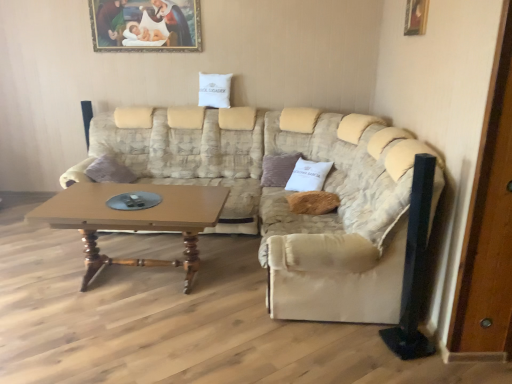
Question: Considering the relative positions of wooden picture frame at upper right, which is the 1th picture frame in bottom-to-top order, and wooden framed painting at upper center, marked as the 2th picture frame in a front-to-back arrangement, in the image provided, is wooden picture frame at upper right, which is the 1th picture frame in bottom-to-top order, to the right of wooden framed painting at upper center, marked as the 2th picture frame in a front-to-back arrangement, from the viewer's perspective?

Choices:
 (A) no
 (B) yes

Answer: (B)

Question: From a real-world perspective, is wooden picture frame at upper right, positioned as the 1th picture frame in right-to-left order, physically below wooden framed painting at upper center, placed as the 2th picture frame when sorted from right to left?

Choices:
 (A) yes
 (B) no

Answer: (A)

Question: Considering the relative positions of wooden picture frame at upper right, positioned as the 1th picture frame in right-to-left order, and wooden framed painting at upper center, the 2th picture frame when ordered from bottom to top, in the image provided, is wooden picture frame at upper right, positioned as the 1th picture frame in right-to-left order, in front of wooden framed painting at upper center, the 2th picture frame when ordered from bottom to top,?

Choices:
 (A) no
 (B) yes

Answer: (B)

Question: Considering the relative sizes of wooden picture frame at upper right, positioned as the 1th picture frame in right-to-left order, and wooden framed painting at upper center, positioned as the 1th picture frame in left-to-right order, in the image provided, is wooden picture frame at upper right, positioned as the 1th picture frame in right-to-left order, shorter than wooden framed painting at upper center, positioned as the 1th picture frame in left-to-right order,?

Choices:
 (A) yes
 (B) no

Answer: (A)

Question: Is wooden picture frame at upper right, which is the 1th picture frame in bottom-to-top order, thinner than wooden framed painting at upper center, positioned as the 1th picture frame in left-to-right order?

Choices:
 (A) yes
 (B) no

Answer: (B)

Question: Is wooden picture frame at upper right, which ranks as the 1th picture frame in front-to-back order, bigger than wooden framed painting at upper center, the first picture frame positioned from the back?

Choices:
 (A) yes
 (B) no

Answer: (B)

Question: Can you confirm if brown fabric pillow at center, which is the 2th pillow from back to front, is bigger than wooden framed painting at upper center, placed as the first picture frame when sorted from top to bottom?

Choices:
 (A) yes
 (B) no

Answer: (A)

Question: Is brown fabric pillow at center, which is the 2th pillow from back to front, beside wooden framed painting at upper center, positioned as the 1th picture frame in left-to-right order?

Choices:
 (A) yes
 (B) no

Answer: (B)

Question: Would you say brown fabric pillow at center, the second pillow in the front-to-back sequence, is outside wooden framed painting at upper center, positioned as the 1th picture frame in left-to-right order?

Choices:
 (A) no
 (B) yes

Answer: (B)

Question: Considering the relative sizes of brown fabric pillow at center, which ranks as the 2th pillow in left-to-right order, and wooden framed painting at upper center, positioned as the 1th picture frame in left-to-right order, in the image provided, is brown fabric pillow at center, which ranks as the 2th pillow in left-to-right order, taller than wooden framed painting at upper center, positioned as the 1th picture frame in left-to-right order,?

Choices:
 (A) yes
 (B) no

Answer: (B)

Question: From a real-world perspective, does brown fabric pillow at center, the 2th pillow positioned from the right, stand above wooden framed painting at upper center, the first picture frame positioned from the back?

Choices:
 (A) no
 (B) yes

Answer: (A)

Question: Considering the relative sizes of brown fabric pillow at center, the 2th pillow when ordered from top to bottom, and wooden framed painting at upper center, the 2th picture frame when ordered from bottom to top, in the image provided, is brown fabric pillow at center, the 2th pillow when ordered from top to bottom, shorter than wooden framed painting at upper center, the 2th picture frame when ordered from bottom to top,?

Choices:
 (A) yes
 (B) no

Answer: (A)

Question: Does wooden door at right have a greater height compared to wooden picture frame at upper right, positioned as the 1th picture frame in right-to-left order?

Choices:
 (A) no
 (B) yes

Answer: (B)